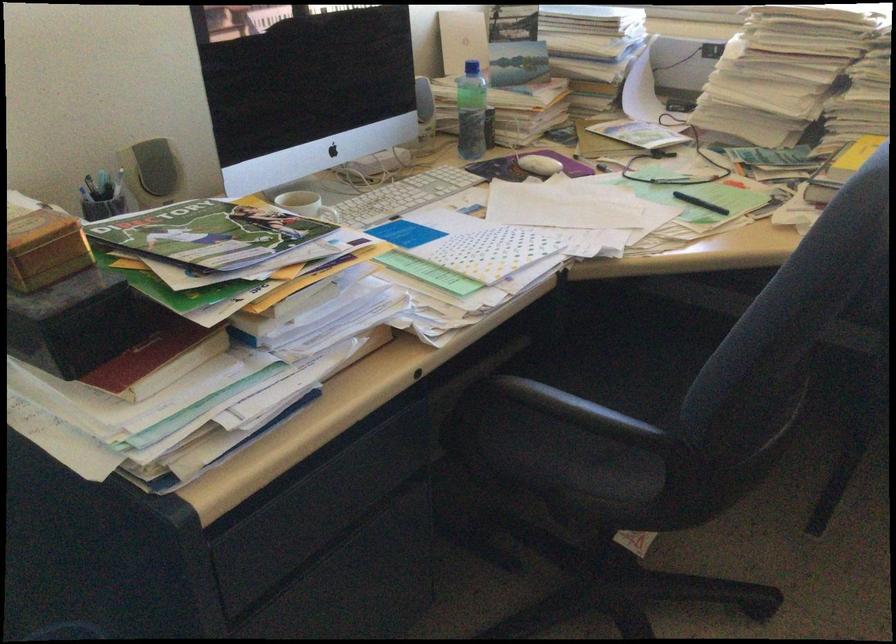
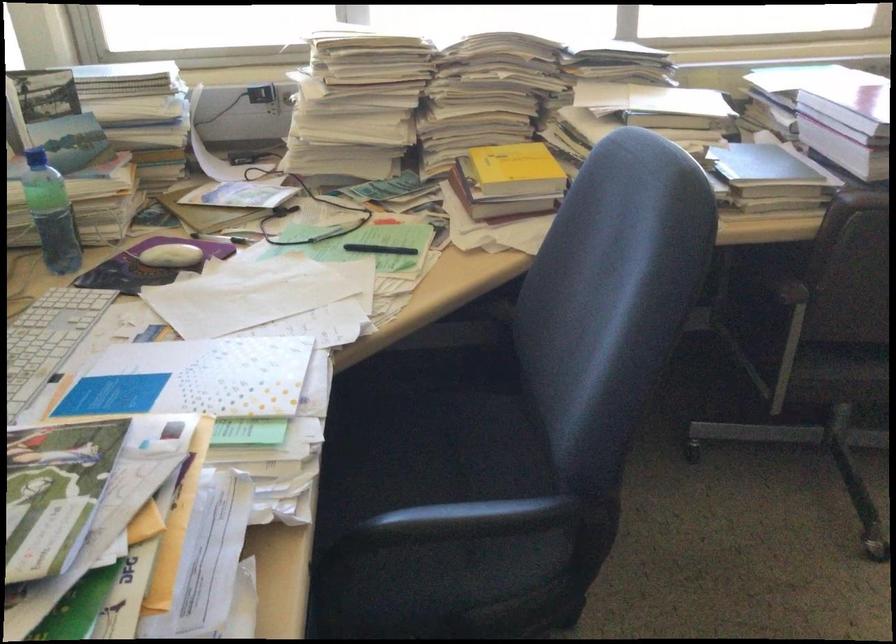
Question: The camera is either moving clockwise (left) or counter-clockwise (right) around the object. The first image is from the beginning of the video and the second image is from the end. Is the camera moving left or right when shooting the video?

Choices:
 (A) Left
 (B) Right

Answer: (A)